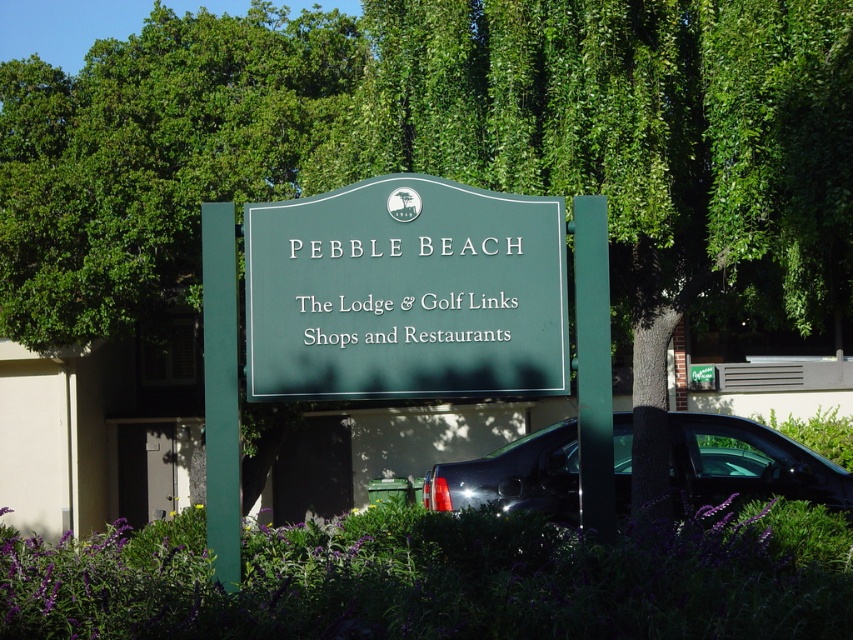
Question: Which object is farther from the camera taking this photo?

Choices:
 (A) glossy black truck at lower right
 (B) green polished wood sign at center
 (C) purple leafy bush at lower center

Answer: (A)

Question: Is purple leafy bush at lower center closer to camera compared to glossy black truck at lower right?

Choices:
 (A) yes
 (B) no

Answer: (A)

Question: Which object appears closest to the camera in this image?

Choices:
 (A) glossy black truck at lower right
 (B) green polished wood sign at center
 (C) purple leafy bush at lower center

Answer: (C)

Question: Does purple leafy bush at lower center appear on the right side of glossy black truck at lower right?

Choices:
 (A) no
 (B) yes

Answer: (A)

Question: In this image, where is purple leafy bush at lower center located relative to glossy black truck at lower right?

Choices:
 (A) left
 (B) right

Answer: (A)

Question: Based on their relative distances, which object is farther from the glossy black truck at lower right?

Choices:
 (A) green polished wood sign at center
 (B) purple leafy bush at lower center

Answer: (A)